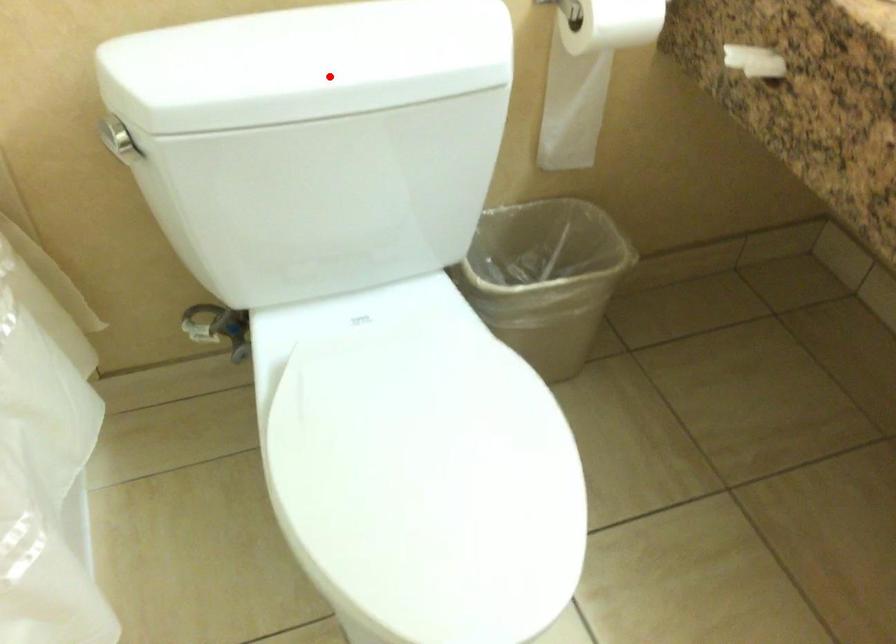
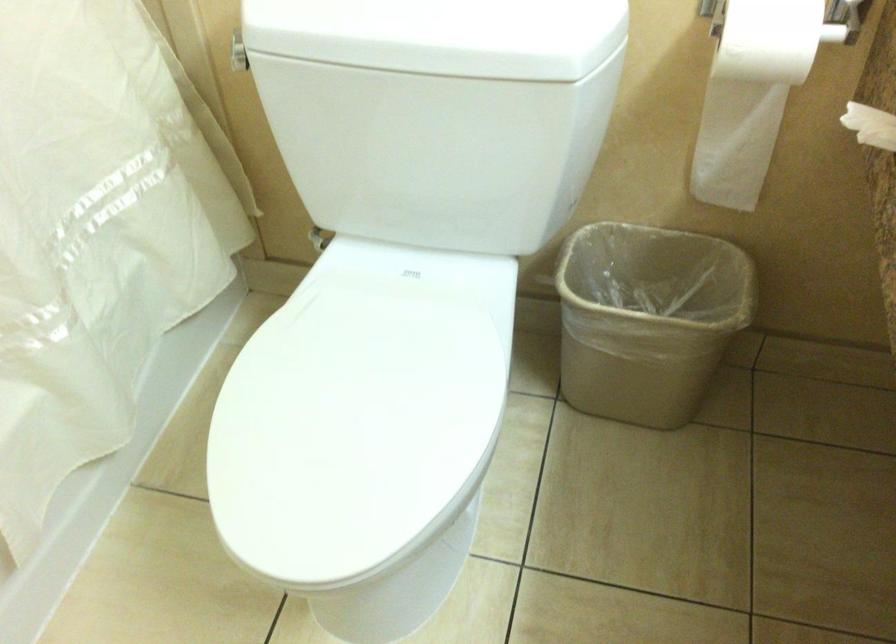
The point at the highlighted location is marked in the first image. Where is the corresponding point in the second image?

(393, 35)